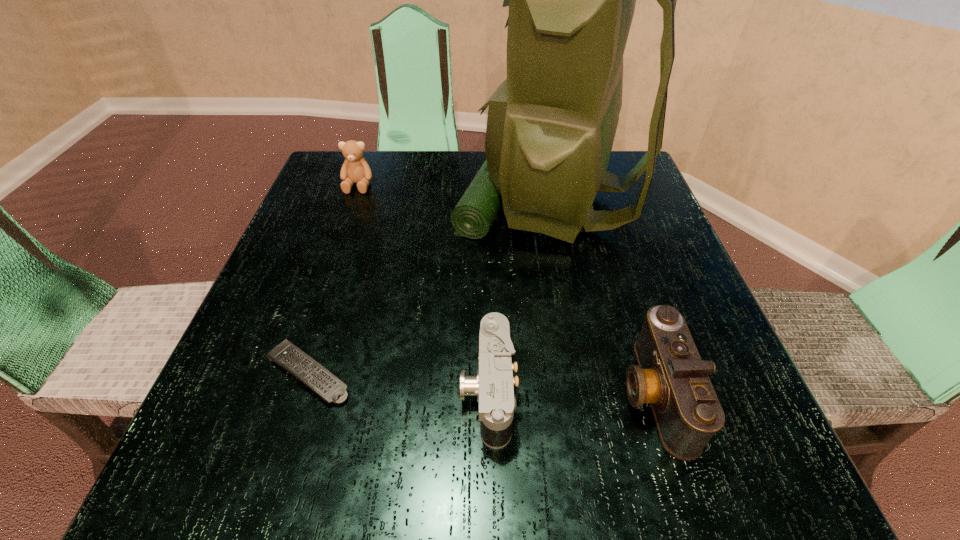
Where is `vacant area between the shortest object and the teddy bear`? Image resolution: width=960 pixels, height=540 pixels. vacant area between the shortest object and the teddy bear is located at coordinates (333, 279).

This screenshot has width=960, height=540. What are the coordinates of `object identified as the closest to the second shortest object` in the screenshot? It's located at (670, 375).

The image size is (960, 540). Find the location of `object that is the second closest one to the backpack`. object that is the second closest one to the backpack is located at coordinates (493, 385).

The image size is (960, 540). Identify the location of vacant area in the image that satisfies the following two spatial constraints: 1. on the front-facing side of the remote control; 2. on the left side of the teddy bear. (293, 373).

Where is `free space that satisfies the following two spatial constraints: 1. on the front-facing side of the teddy bear; 2. on the left side of the remote control`? The image size is (960, 540). free space that satisfies the following two spatial constraints: 1. on the front-facing side of the teddy bear; 2. on the left side of the remote control is located at coordinates (293, 373).